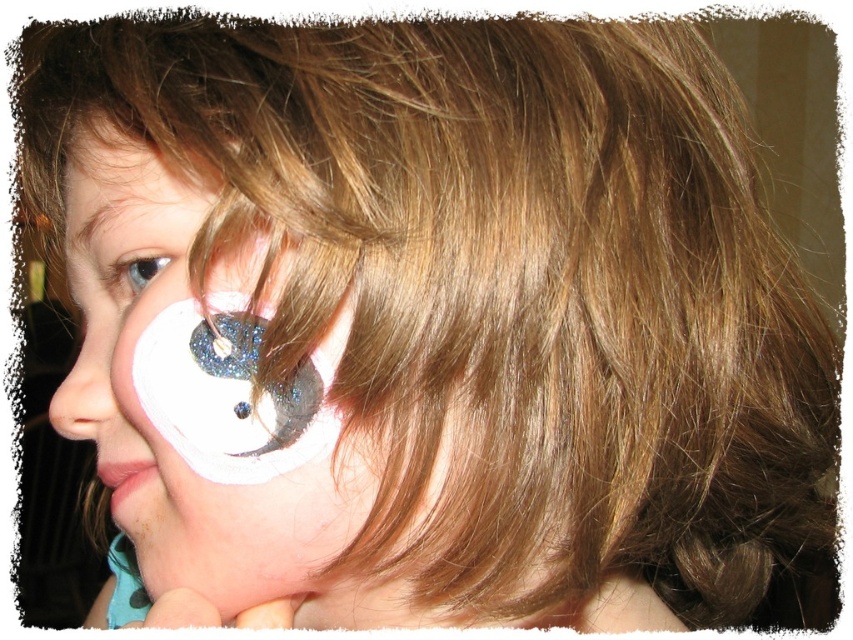
From the picture: Is white matte face paint at center shorter than brown matte eyebrow at upper left?

No, white matte face paint at center is not shorter than brown matte eyebrow at upper left.

The height and width of the screenshot is (640, 853). In order to click on white matte face paint at center in this screenshot , I will do `click(196, 426)`.

Is point (103, 212) less distant than point (84, 433)?

Yes, point (103, 212) is in front of point (84, 433).

Does brown matte eyebrow at upper left appear on the right side of matte white nose at lower left?

Yes, brown matte eyebrow at upper left is to the right of matte white nose at lower left.

At what (x,y) coordinates should I click in order to perform the action: click on brown matte eyebrow at upper left. Please return your answer as a coordinate pair (x, y). Looking at the image, I should click on (111, 220).

In the scene shown: Does brown matte eyebrow at upper left have a greater height compared to white glittery eye at upper left?

Indeed, brown matte eyebrow at upper left has a greater height compared to white glittery eye at upper left.

Does brown matte eyebrow at upper left come behind white glittery eye at upper left?

No, it is in front of white glittery eye at upper left.

Does point (64, 200) lie behind point (108, 268)?

Yes, it is behind point (108, 268).

The image size is (853, 640). I want to click on brown matte eyebrow at upper left, so click(x=111, y=220).